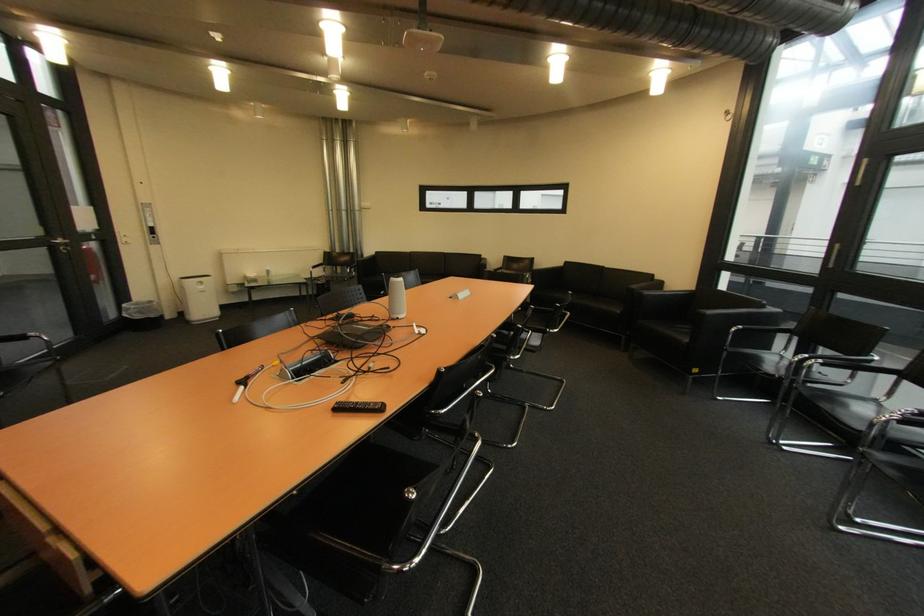
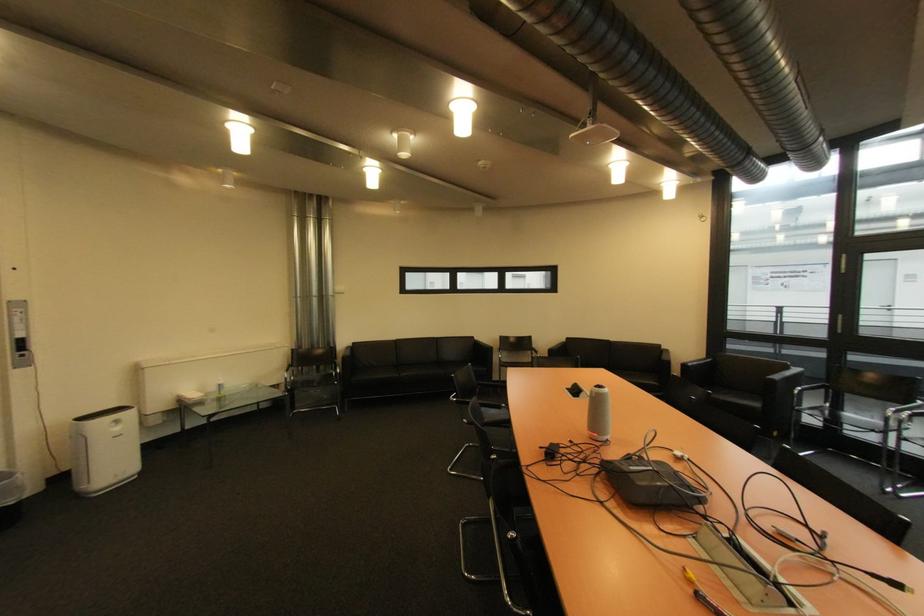
Where in the second image is the point corresponding to point 209,288 from the first image?

(124, 430)